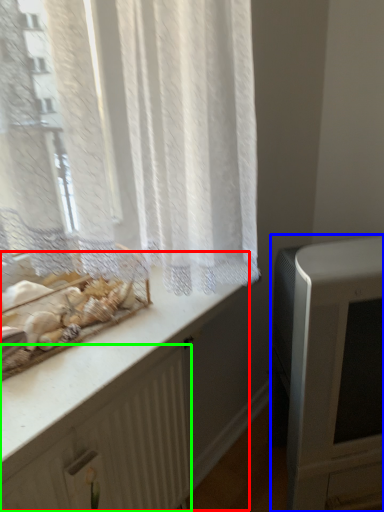
Question: Based on their relative distances, which object is farther from counter (highlighted by a red box)? Choose from appliance (highlighted by a blue box) and radiator (highlighted by a green box).

Choices:
 (A) appliance
 (B) radiator

Answer: (A)